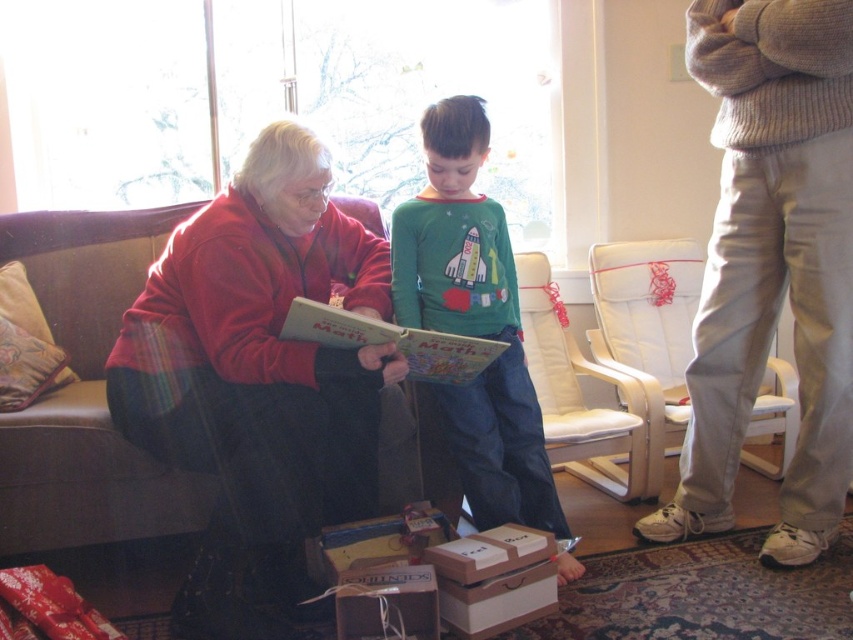
Can you confirm if green cotton shirt at center is wider than brown cardboard box at lower center?

Indeed, green cotton shirt at center has a greater width compared to brown cardboard box at lower center.

Can you confirm if green cotton shirt at center is thinner than brown cardboard box at lower center?

No, green cotton shirt at center is not thinner than brown cardboard box at lower center.

Does point (543, 515) come behind point (387, 625)?

That is True.

Where is `green cotton shirt at center`? green cotton shirt at center is located at coordinates (473, 321).

Who is positioned more to the right, green cotton shirt at center or wooden box at lower center?

From the viewer's perspective, wooden box at lower center appears more on the right side.

Is point (525, 472) farther from viewer compared to point (479, 582)?

That is True.

The height and width of the screenshot is (640, 853). What are the coordinates of `green cotton shirt at center` in the screenshot? It's located at (473, 321).

Does white leather armchair at right appear on the right side of brown cardboard box at lower center?

Yes, white leather armchair at right is to the right of brown cardboard box at lower center.

Does white leather armchair at right lie behind brown cardboard box at lower center?

Yes.

The height and width of the screenshot is (640, 853). I want to click on white leather armchair at right, so click(x=648, y=330).